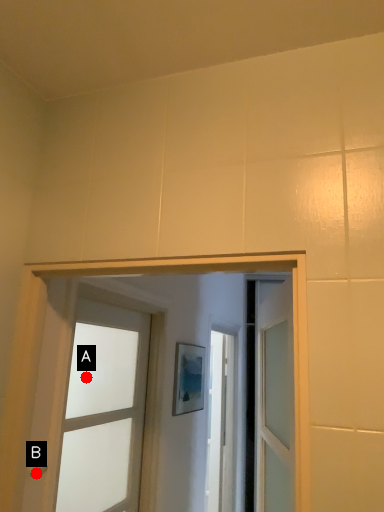
Question: Two points are circled on the image, labeled by A and B beside each circle. Among these points, which one is nearest to the camera?

Choices:
 (A) A is closer
 (B) B is closer

Answer: (B)